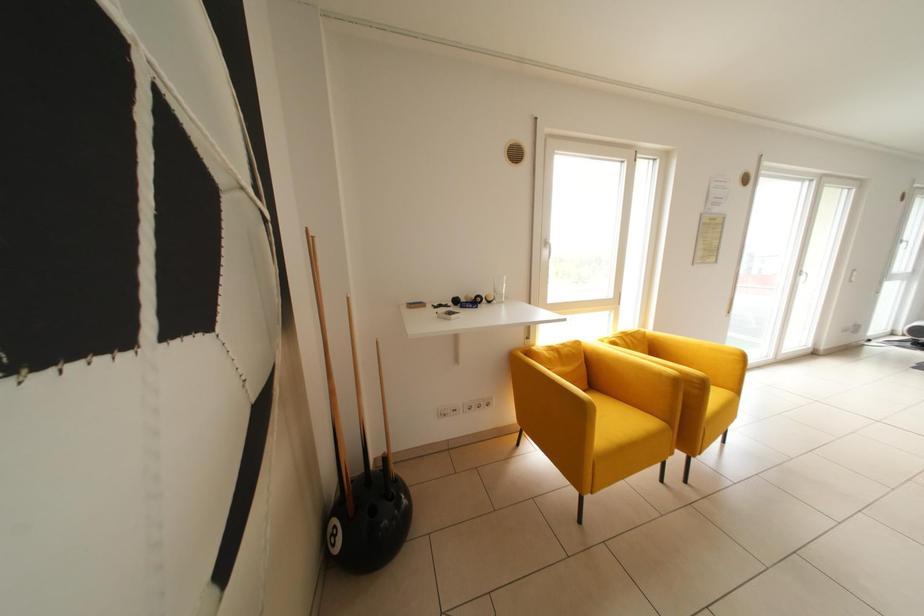
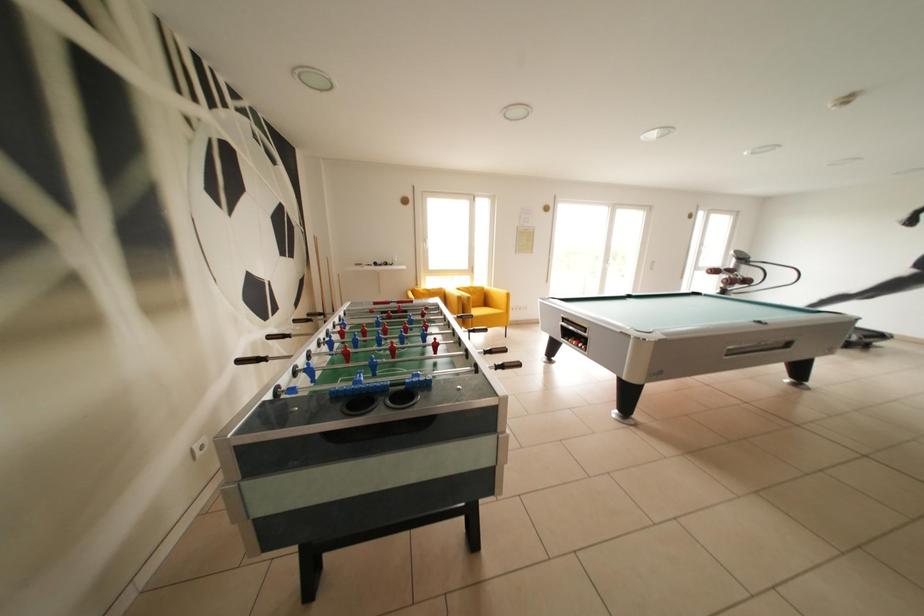
Which direction would the cameraman need to move to produce the second image?

The movement direction of the cameraman is right, backward.